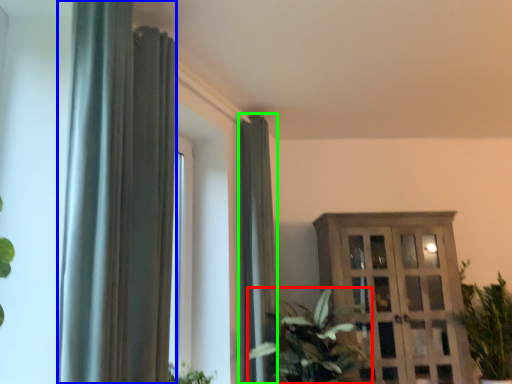
Question: Estimate the real-world distances between objects in this image. Which object is closer to houseplant (highlighted by a red box), curtain (highlighted by a blue box) or curtain (highlighted by a green box)?

Choices:
 (A) curtain
 (B) curtain

Answer: (B)